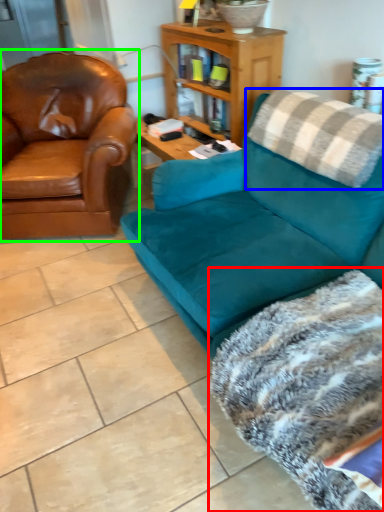
Question: Considering the real-world distances, which object is farthest from blanket (highlighted by a red box)? pillow (highlighted by a blue box) or chair (highlighted by a green box)?

Choices:
 (A) pillow
 (B) chair

Answer: (B)